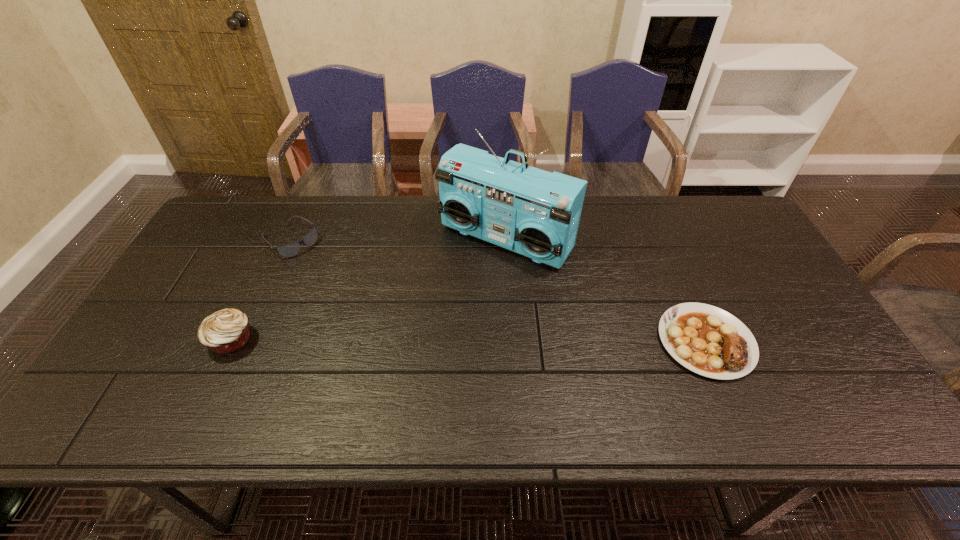
This screenshot has width=960, height=540. What are the coordinates of `free spot at the far left corner of the desktop` in the screenshot? It's located at (238, 205).

In the image, there is a desktop. Identify the location of free space at the far right corner. This screenshot has width=960, height=540. (719, 198).

The image size is (960, 540). What are the coordinates of `free point between the rightmost object and the second tallest object` in the screenshot? It's located at (468, 341).

I want to click on vacant area that lies between the tallest object and the sunglasses, so click(x=398, y=240).

Find the location of `free space between the muffin and the sunglasses`. free space between the muffin and the sunglasses is located at coordinates (261, 290).

In order to click on blank region between the muffin and the third object from left to right in this screenshot , I will do `click(369, 289)`.

Find the location of a particular element. The image size is (960, 540). unoccupied area between the third shortest object and the rightmost object is located at coordinates (468, 341).

Locate an element on the screen. free area in between the rightmost object and the second tallest object is located at coordinates (468, 341).

Image resolution: width=960 pixels, height=540 pixels. I want to click on empty space that is in between the steak and the sunglasses, so click(x=498, y=291).

I want to click on empty location between the third shortest object and the steak, so click(x=468, y=341).